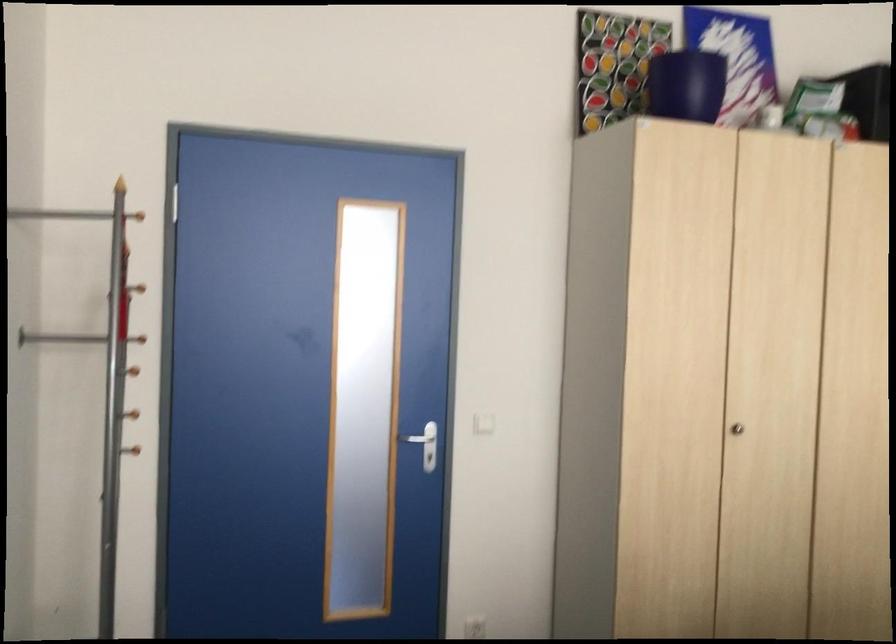
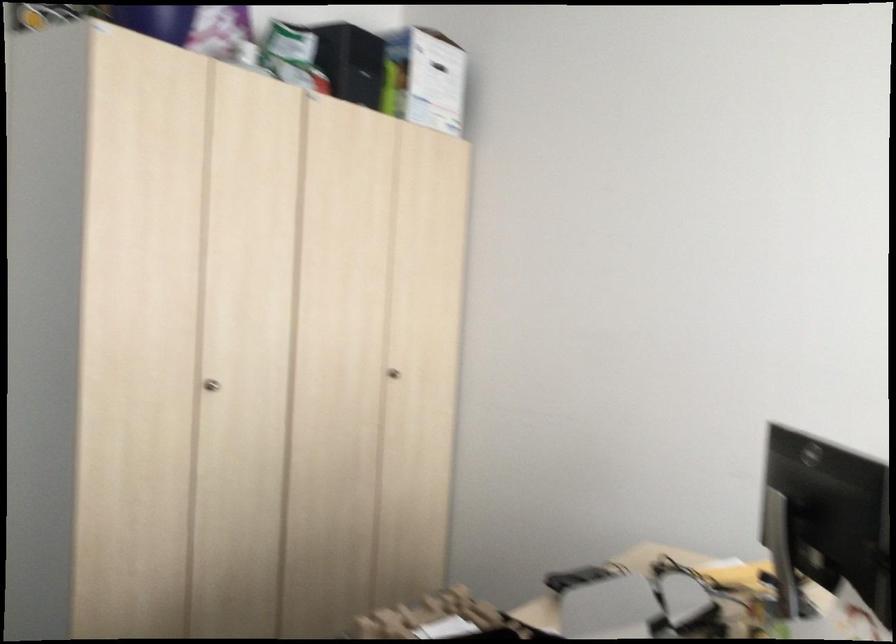
Question: The camera is either moving clockwise (left) or counter-clockwise (right) around the object. The first image is from the beginning of the video and the second image is from the end. Is the camera moving left or right when shooting the video?

Choices:
 (A) Left
 (B) Right

Answer: (A)